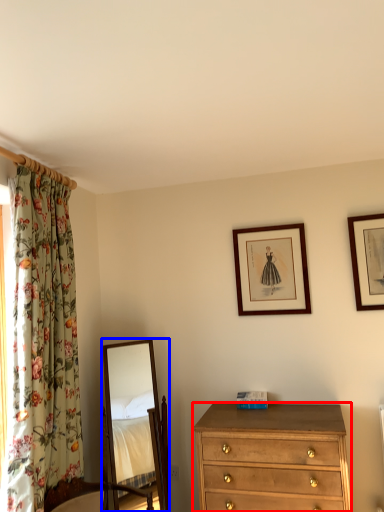
Question: Which object appears farthest to the camera in this image, chest of drawers (highlighted by a red box) or mirror (highlighted by a blue box)?

Choices:
 (A) chest of drawers
 (B) mirror

Answer: (B)